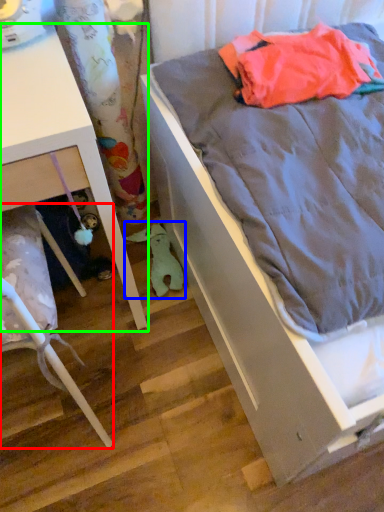
Question: Which object is the farthest from furniture (highlighted by a red box)? Choose among these: stuff (highlighted by a blue box) or furniture (highlighted by a green box).

Choices:
 (A) stuff
 (B) furniture

Answer: (A)